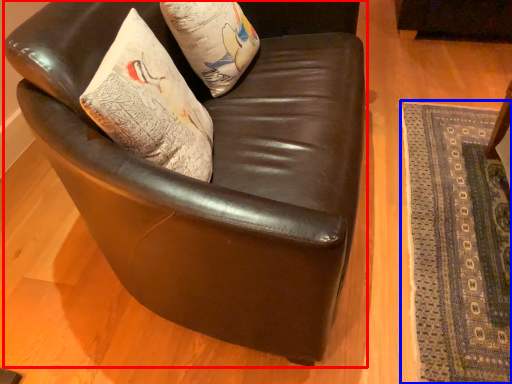
Question: Among these objects, which one is farthest to the camera, chair (highlighted by a red box) or mat (highlighted by a blue box)?

Choices:
 (A) chair
 (B) mat

Answer: (B)